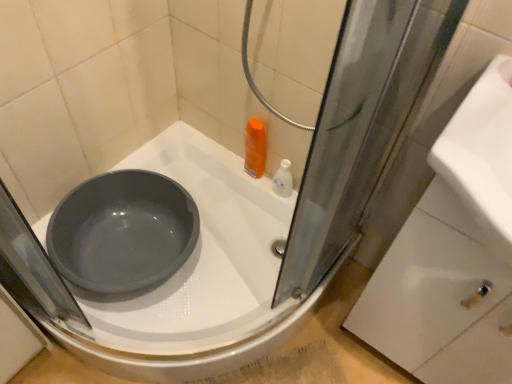
Question: From the image's perspective, does white glossy drawer at lower right appear lower than white glossy bottle at upper right?

Choices:
 (A) no
 (B) yes

Answer: (B)

Question: Would you consider white glossy drawer at lower right to be distant from white glossy bottle at upper right?

Choices:
 (A) yes
 (B) no

Answer: (B)

Question: Can you confirm if white glossy drawer at lower right is bigger than white glossy bottle at upper right?

Choices:
 (A) yes
 (B) no

Answer: (A)

Question: From a real-world perspective, is white glossy drawer at lower right under white glossy bottle at upper right?

Choices:
 (A) yes
 (B) no

Answer: (B)

Question: Considering the relative sizes of white glossy drawer at lower right and white glossy bottle at upper right in the image provided, is white glossy drawer at lower right smaller than white glossy bottle at upper right?

Choices:
 (A) yes
 (B) no

Answer: (B)

Question: Is white glossy drawer at lower right at the right side of white glossy bottle at upper right?

Choices:
 (A) no
 (B) yes

Answer: (B)

Question: Is white glossy drawer at lower right further to camera compared to matte gray basin at center?

Choices:
 (A) no
 (B) yes

Answer: (A)

Question: Can you confirm if white glossy drawer at lower right is positioned to the right of matte gray basin at center?

Choices:
 (A) no
 (B) yes

Answer: (B)

Question: Is white glossy drawer at lower right shorter than matte gray basin at center?

Choices:
 (A) yes
 (B) no

Answer: (B)

Question: Is white glossy drawer at lower right positioned beyond the bounds of matte gray basin at center?

Choices:
 (A) yes
 (B) no

Answer: (A)

Question: From the image's perspective, is white glossy drawer at lower right on matte gray basin at center?

Choices:
 (A) yes
 (B) no

Answer: (B)

Question: Does white glossy drawer at lower right have a greater width compared to matte gray basin at center?

Choices:
 (A) yes
 (B) no

Answer: (B)

Question: Would you consider white glossy bottle at upper right to be distant from white glossy drawer at lower right?

Choices:
 (A) yes
 (B) no

Answer: (B)